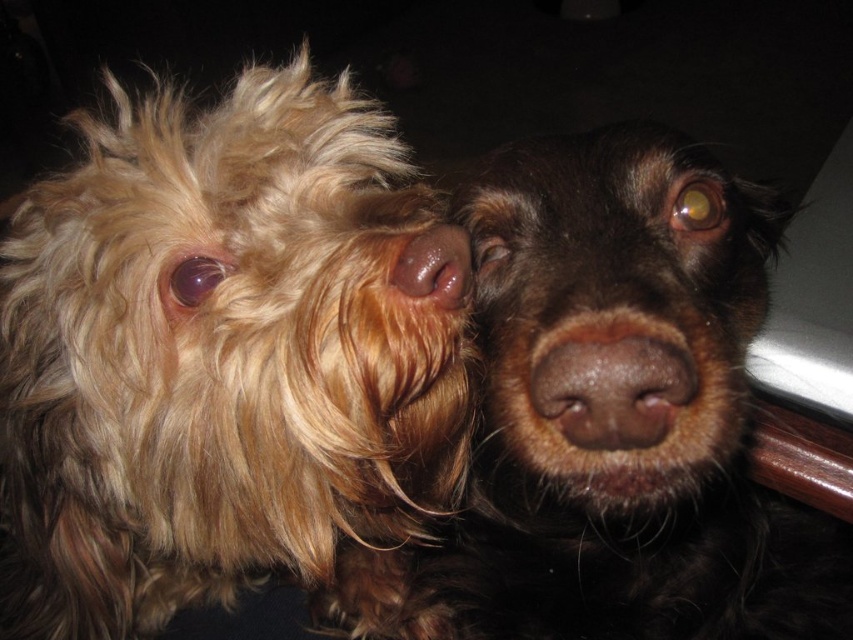
Question: In this image, where is brown matte nose at center located relative to glossy brown nose at center?

Choices:
 (A) left
 (B) right

Answer: (B)

Question: Estimate the real-world distances between objects in this image. Which object is closer to the glossy brown nose at center?

Choices:
 (A) shaggy golden fur at left
 (B) brown furry dog at center

Answer: (B)

Question: Is shaggy golden fur at left bigger than glossy brown nose at center?

Choices:
 (A) yes
 (B) no

Answer: (A)

Question: Among these points, which one is nearest to the camera?

Choices:
 (A) (401, 308)
 (B) (601, 417)
 (C) (428, 230)

Answer: (B)

Question: Among these objects, which one is farthest from the camera?

Choices:
 (A) brown furry dog at center
 (B) shaggy golden fur at left
 (C) brown matte nose at center

Answer: (B)

Question: Is brown furry dog at center further to camera compared to brown matte nose at center?

Choices:
 (A) no
 (B) yes

Answer: (A)